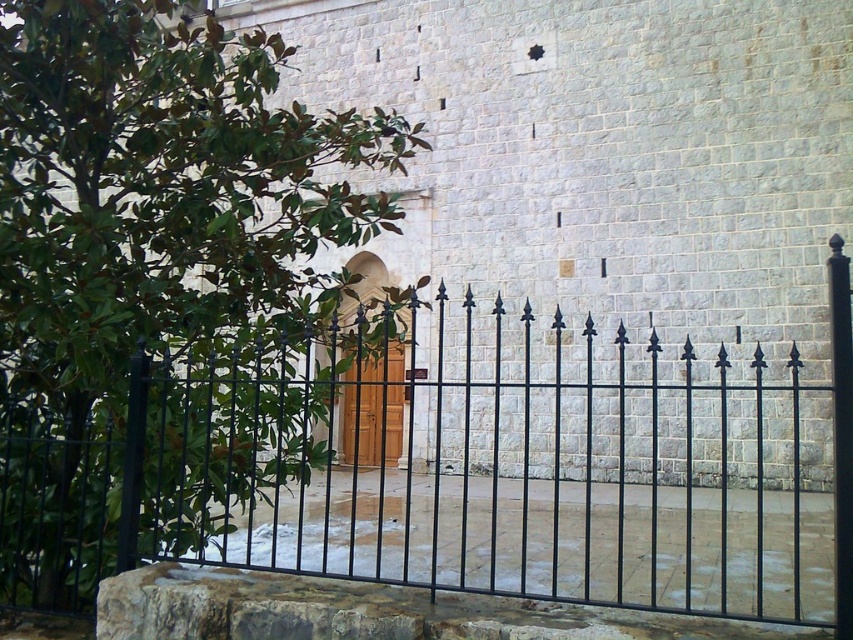
Question: Is black wrought iron fence at center above green leafy tree at left?

Choices:
 (A) no
 (B) yes

Answer: (A)

Question: Can you confirm if black wrought iron fence at center is positioned to the left of green leafy tree at left?

Choices:
 (A) no
 (B) yes

Answer: (A)

Question: Among these points, which one is farthest from the camera?

Choices:
 (A) (4, 435)
 (B) (235, 372)

Answer: (A)

Question: Can you confirm if black wrought iron fence at center is positioned to the left of wooden door at center?

Choices:
 (A) yes
 (B) no

Answer: (B)

Question: Which object is the farthest from the black wrought iron fence at center?

Choices:
 (A) wooden door at center
 (B) green leafy tree at left

Answer: (A)

Question: Which point is closer to the camera?

Choices:
 (A) wooden door at center
 (B) black wrought iron fence at center

Answer: (B)